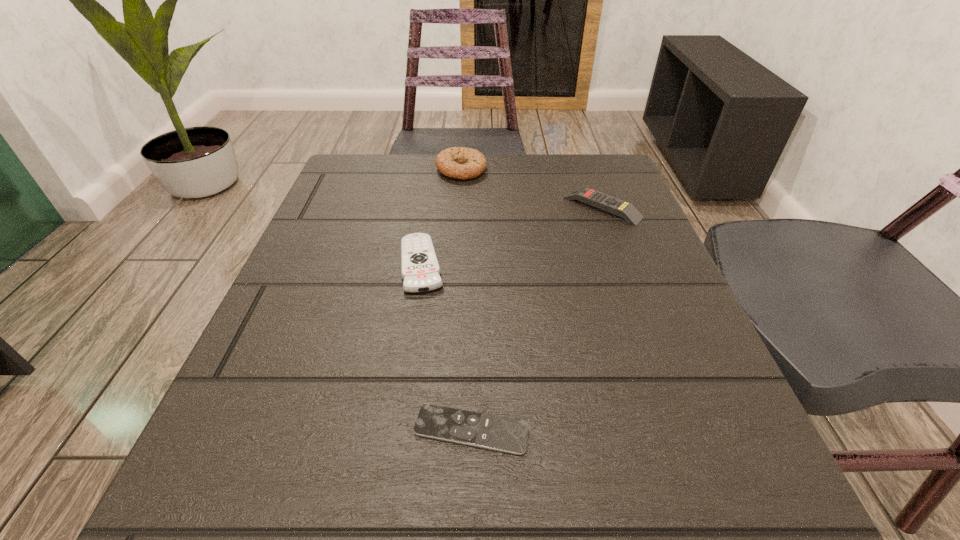
This screenshot has height=540, width=960. What are the coordinates of `bagel` in the screenshot? It's located at (463, 163).

The image size is (960, 540). I want to click on the farthest object, so [x=463, y=163].

At what (x,y) coordinates should I click in order to perform the action: click on the rightmost remote control. Please return your answer as a coordinate pair (x, y). The height and width of the screenshot is (540, 960). Looking at the image, I should click on [x=626, y=210].

I want to click on the tallest remote control, so click(x=626, y=210).

The image size is (960, 540). In order to click on the second tallest remote control in this screenshot , I will do `click(420, 270)`.

This screenshot has width=960, height=540. I want to click on the second farthest remote control, so click(x=420, y=270).

Locate an element on the screen. the shortest remote control is located at coordinates (491, 432).

At what (x,y) coordinates should I click in order to perform the action: click on the shortest object. Please return your answer as a coordinate pair (x, y). The height and width of the screenshot is (540, 960). Looking at the image, I should click on (491, 432).

At what (x,y) coordinates should I click in order to perform the action: click on vacant area situated on the front of the bagel. Please return your answer as a coordinate pair (x, y). Image resolution: width=960 pixels, height=540 pixels. Looking at the image, I should click on (457, 239).

The width and height of the screenshot is (960, 540). What are the coordinates of `vacant position located on the front of the second tallest object` in the screenshot? It's located at (641, 312).